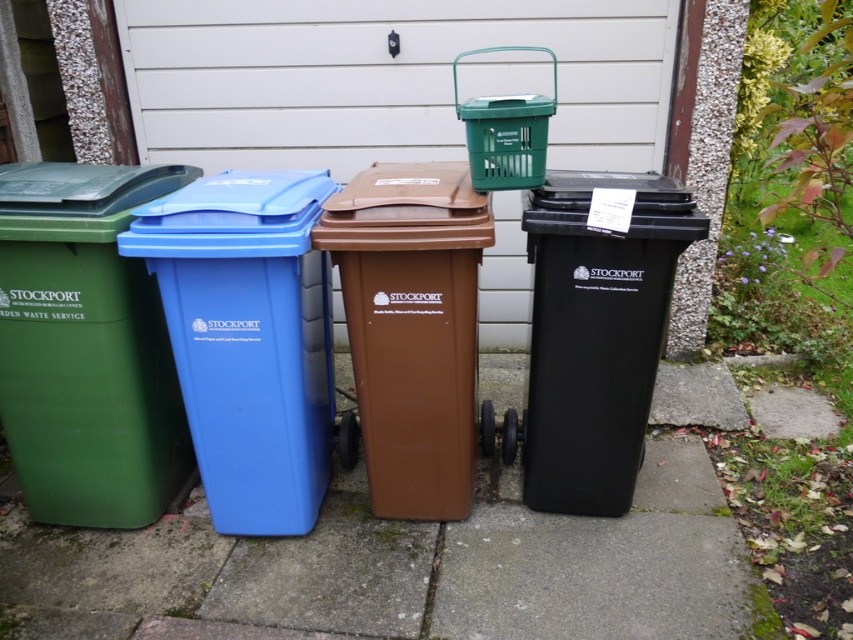
You are a waste collector who needs to load these bins onto a truck. The truck has a height restriction of 1.2 meters. You see the brown matte plastic recycling bin at center and the black plastic recycling bin at right. Which bin should you load first to ensure it fits under the height limit?

The black plastic recycling bin at right should be loaded first because the brown matte plastic recycling bin at center is taller than the black plastic recycling bin at right, so the black bin is more likely to fit under the 1.2 meter height restriction.

You are standing in front of the recycling bins and need to place an item into the bin that is closest to you. The bins are arranged from left to right as green, blue, brown, and black. There is also a small green basket above the brown bin. If you are at point (442, 454), which bin is closest to you?

The point (442, 454) is 7.51 feet away from the camera. Since the bins are arranged in a straight line from left to right, the closest bin would depend on their positions. However, without specific distance information for each bin, we cannot determine which is closest. The answer cannot be provided with the given data.